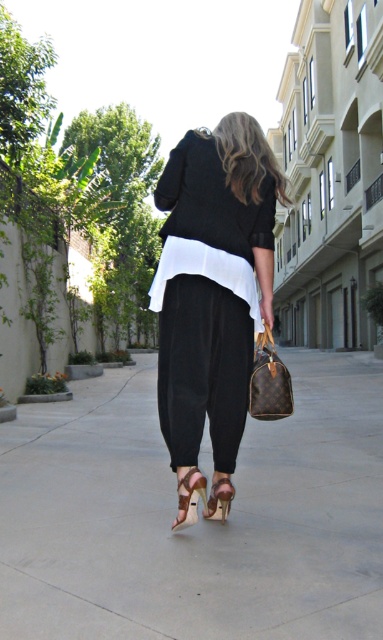
Is smooth concrete pavement at center taller than matte black blazer at center?

In fact, smooth concrete pavement at center may be shorter than matte black blazer at center.

Who is taller, smooth concrete pavement at center or matte black blazer at center?

matte black blazer at center

The height and width of the screenshot is (640, 383). What do you see at coordinates (199, 518) in the screenshot?
I see `smooth concrete pavement at center` at bounding box center [199, 518].

You are a GUI agent. You are given a task and a screenshot of the screen. Output one action in this format:
    pyautogui.click(x=<x>, y=<y>)
    Task: Click on the smooth concrete pavement at center
    The image size is (383, 640).
    Given the screenshot: What is the action you would take?
    pyautogui.click(x=199, y=518)

Can you confirm if smooth concrete pavement at center is positioned to the right of suede tan sandal at lower center?

Correct, you'll find smooth concrete pavement at center to the right of suede tan sandal at lower center.

Who is positioned more to the right, smooth concrete pavement at center or suede tan sandal at lower center?

smooth concrete pavement at center

Which is behind, point (348, 602) or point (214, 483)?

The point (214, 483) is more distant.

Find the location of `smooth concrete pavement at center`. smooth concrete pavement at center is located at coordinates (199, 518).

Does matte black blazer at center have a lesser width compared to suede tan sandal at lower center?

No, matte black blazer at center is not thinner than suede tan sandal at lower center.

Can you confirm if matte black blazer at center is positioned to the left of suede tan sandal at lower center?

Incorrect, matte black blazer at center is not on the left side of suede tan sandal at lower center.

Find the location of a particular element. This screenshot has width=383, height=640. matte black blazer at center is located at coordinates (212, 284).

Locate an element on the screen. The width and height of the screenshot is (383, 640). matte black blazer at center is located at coordinates (212, 284).